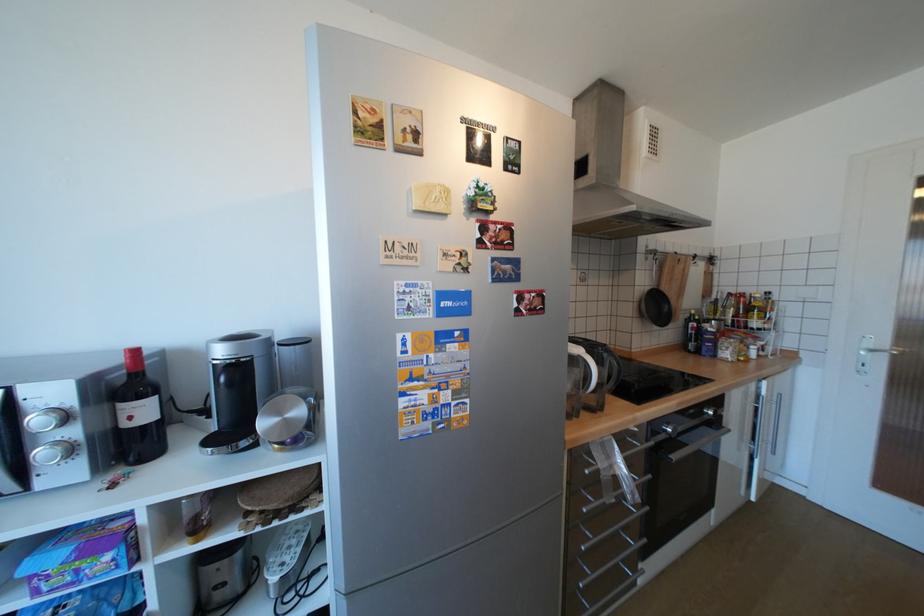
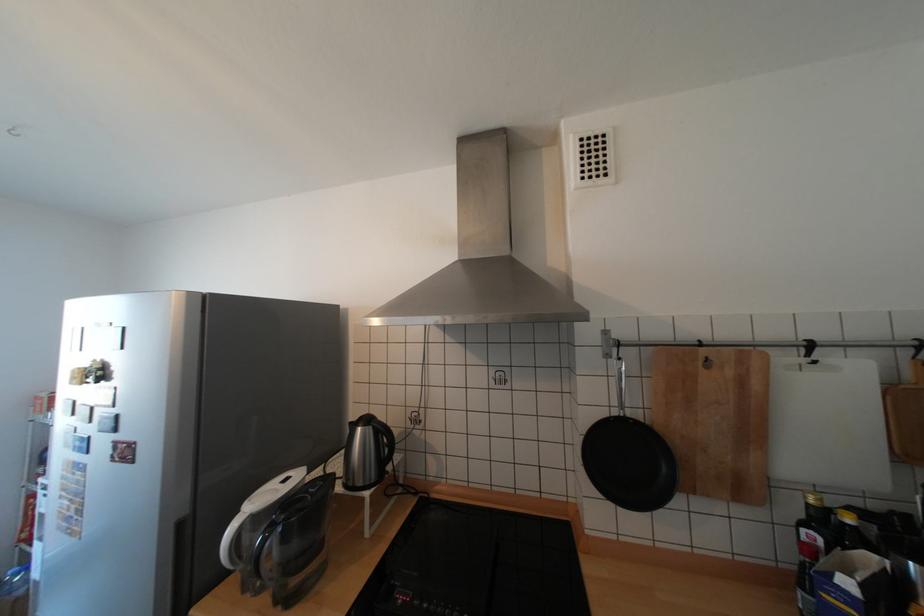
In the second image, find the point that corresponds to pixel 700 314 in the first image.

(817, 505)